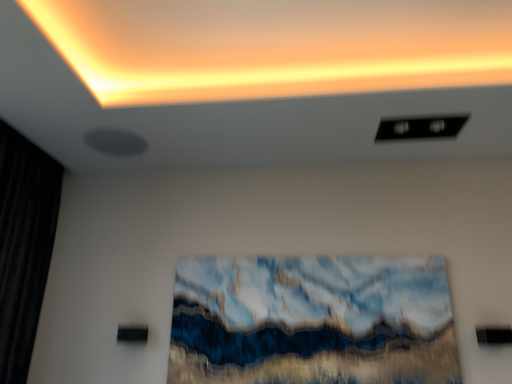
Question: From the image's perspective, is black fabric curtain at left beneath matte orange glow at upper center?

Choices:
 (A) yes
 (B) no

Answer: (A)

Question: Is black fabric curtain at left thinner than matte orange glow at upper center?

Choices:
 (A) yes
 (B) no

Answer: (A)

Question: Is black fabric curtain at left at the right side of matte orange glow at upper center?

Choices:
 (A) yes
 (B) no

Answer: (B)

Question: Is black fabric curtain at left outside matte orange glow at upper center?

Choices:
 (A) no
 (B) yes

Answer: (B)

Question: From a real-world perspective, is black fabric curtain at left positioned over matte orange glow at upper center based on gravity?

Choices:
 (A) yes
 (B) no

Answer: (B)

Question: In terms of width, does matte orange glow at upper center look wider or thinner when compared to textured blue and white abstract painting at center?

Choices:
 (A) wide
 (B) thin

Answer: (A)

Question: Does point pyautogui.click(x=126, y=24) appear closer or farther from the camera than point pyautogui.click(x=417, y=336)?

Choices:
 (A) closer
 (B) farther

Answer: (A)

Question: In terms of height, does matte orange glow at upper center look taller or shorter compared to textured blue and white abstract painting at center?

Choices:
 (A) tall
 (B) short

Answer: (B)

Question: From a real-world perspective, relative to textured blue and white abstract painting at center, is matte orange glow at upper center vertically above or below?

Choices:
 (A) above
 (B) below

Answer: (A)

Question: In terms of height, does black fabric curtain at left look taller or shorter compared to matte orange glow at upper center?

Choices:
 (A) short
 (B) tall

Answer: (B)

Question: Considering the positions of point (36, 281) and point (262, 71), is point (36, 281) closer or farther from the camera than point (262, 71)?

Choices:
 (A) closer
 (B) farther

Answer: (B)

Question: Is black fabric curtain at left in front of or behind matte orange glow at upper center in the image?

Choices:
 (A) front
 (B) behind

Answer: (B)

Question: Looking at their shapes, would you say black fabric curtain at left is wider or thinner than matte orange glow at upper center?

Choices:
 (A) thin
 (B) wide

Answer: (A)

Question: Is textured blue and white abstract painting at center situated inside black fabric curtain at left or outside?

Choices:
 (A) outside
 (B) inside

Answer: (A)

Question: Considering their positions, is textured blue and white abstract painting at center located in front of or behind black fabric curtain at left?

Choices:
 (A) front
 (B) behind

Answer: (B)